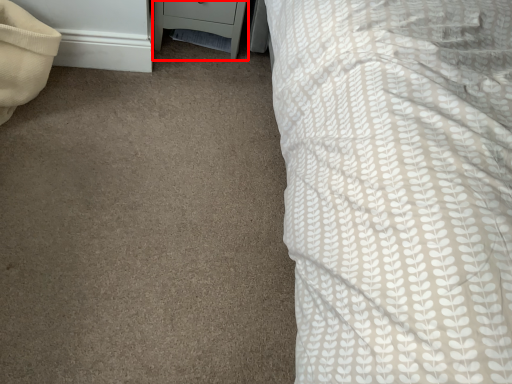
Question: In this image, where is nightstand (annotated by the red box) located relative to pillow?

Choices:
 (A) left
 (B) right

Answer: (B)